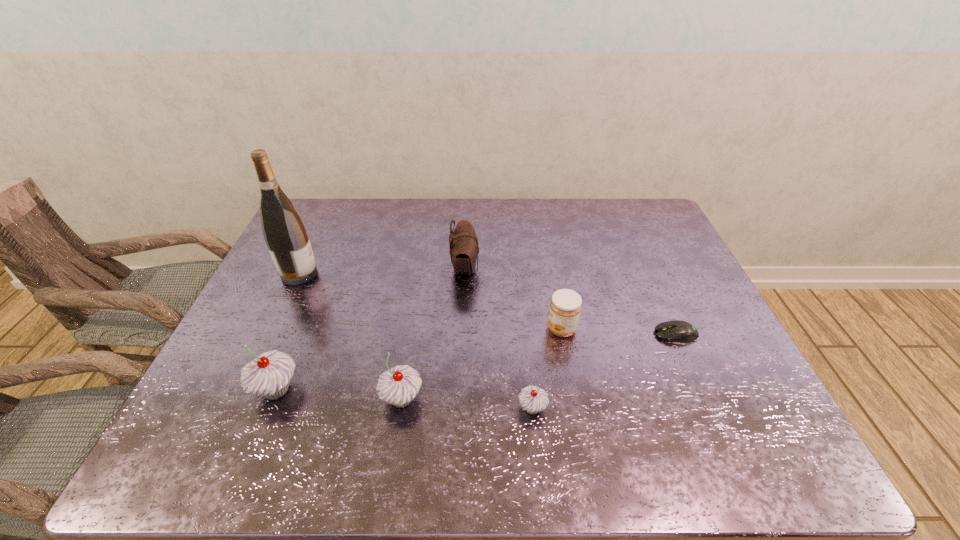
Identify which object is the sixth closest to the pouch. Please provide its 2D coordinates. Your answer should be formatted as a tuple, i.e. [(x, y)], where the tuple contains the x and y coordinates of a point satisfying the conditions above.

[(678, 331)]

The width and height of the screenshot is (960, 540). Find the location of `object that ranks as the second closest to the third object from left to right`. object that ranks as the second closest to the third object from left to right is located at coordinates (533, 399).

Locate which cupcake is the closest to the shortest object. Please provide its 2D coordinates. Your answer should be formatted as a tuple, i.e. [(x, y)], where the tuple contains the x and y coordinates of a point satisfying the conditions above.

[(533, 399)]

Locate which cupcake ranks in proximity to the shortest object. Please provide its 2D coordinates. Your answer should be formatted as a tuple, i.e. [(x, y)], where the tuple contains the x and y coordinates of a point satisfying the conditions above.

[(533, 399)]

At what (x,y) coordinates should I click in order to perform the action: click on free location that satisfies the following two spatial constraints: 1. on the front side of the shortest cupcake; 2. on the right side of the leftmost cupcake. Please return your answer as a coordinate pair (x, y). Looking at the image, I should click on (269, 408).

At what (x,y) coordinates should I click in order to perform the action: click on free space that satisfies the following two spatial constraints: 1. on the back side of the leftmost cupcake; 2. on the label of the wine bottle. Please return your answer as a coordinate pair (x, y). Image resolution: width=960 pixels, height=540 pixels. Looking at the image, I should click on (324, 274).

At what (x,y) coordinates should I click in order to perform the action: click on free space that satisfies the following two spatial constraints: 1. with the flap open on the rightmost cupcake; 2. on the right side of the fourth object from right to left. Please return your answer as a coordinate pair (x, y). Looking at the image, I should click on (460, 408).